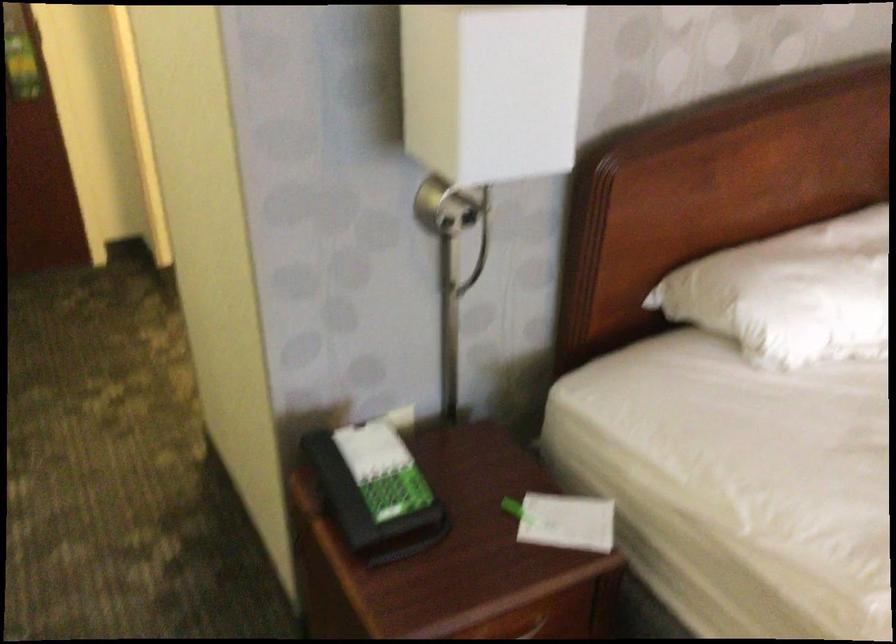
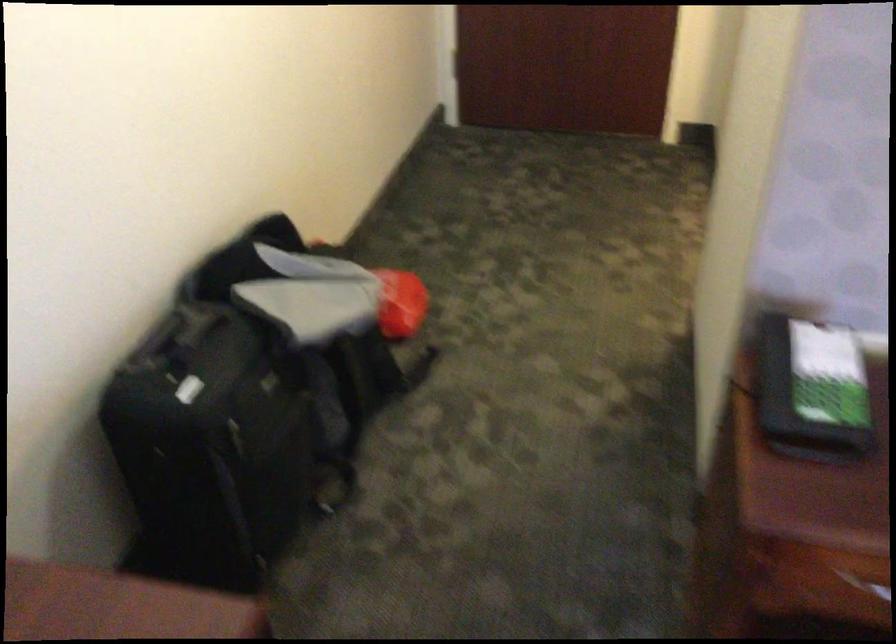
In the second image, find the point that corresponds to the point at 384,498 in the first image.

(812, 390)